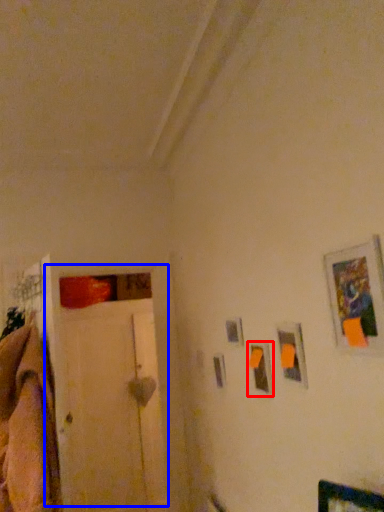
Question: Which object appears farthest to the camera in this image, picture frame (highlighted by a red box) or door (highlighted by a blue box)?

Choices:
 (A) picture frame
 (B) door

Answer: (B)